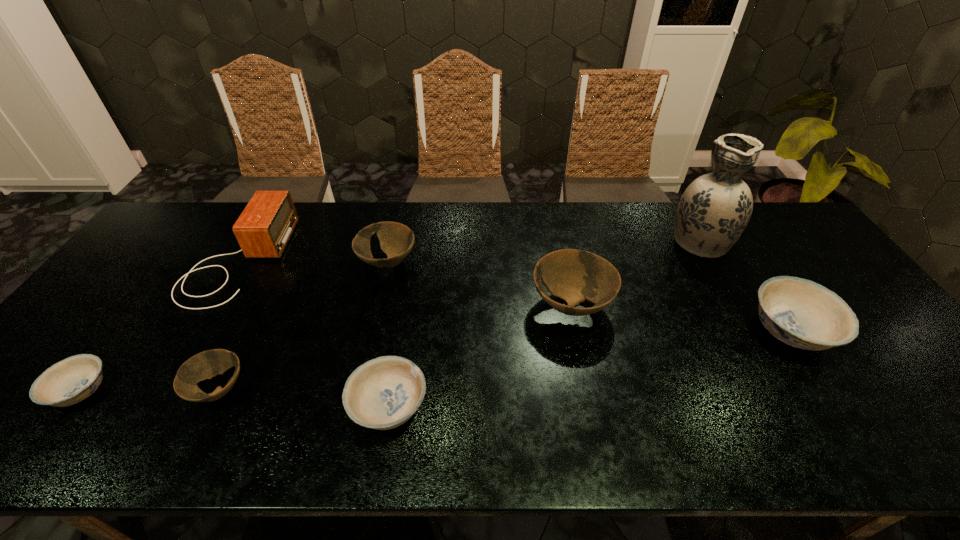
I want to click on vacant space at the far right corner of the desktop, so click(x=766, y=240).

Where is `free space between the rightmost brown bowl and the second biggest blue bowl`? free space between the rightmost brown bowl and the second biggest blue bowl is located at coordinates (480, 356).

I want to click on vacant area that lies between the biggest blue bowl and the second smallest blue bowl, so click(x=589, y=369).

Locate an element on the screen. vacant area that lies between the leftmost brown bowl and the tallest bowl is located at coordinates (395, 348).

At what (x,y) coordinates should I click in order to perform the action: click on vacant area between the biggest blue bowl and the rightmost brown bowl. Please return your answer as a coordinate pair (x, y). Looking at the image, I should click on (681, 318).

Find the location of `free space that is in between the second blue bowl from right to left and the leftmost bowl`. free space that is in between the second blue bowl from right to left and the leftmost bowl is located at coordinates (235, 399).

This screenshot has width=960, height=540. I want to click on vacant area between the second brown bowl from left to right and the rightmost brown bowl, so click(x=479, y=284).

At what (x,y) coordinates should I click in order to perform the action: click on free space between the second smallest brown bowl and the smallest brown bowl. Please return your answer as a coordinate pair (x, y). Looking at the image, I should click on (303, 326).

Identify the location of vacant region between the vase and the third object from right to left. (635, 273).

You are a GUI agent. You are given a task and a screenshot of the screen. Output one action in this format:
    pyautogui.click(x=<x>, y=<y>)
    Task: Click on the vacant area between the blue vase and the sixth object from left to right
    The image size is (960, 540).
    Given the screenshot: What is the action you would take?
    pyautogui.click(x=635, y=273)